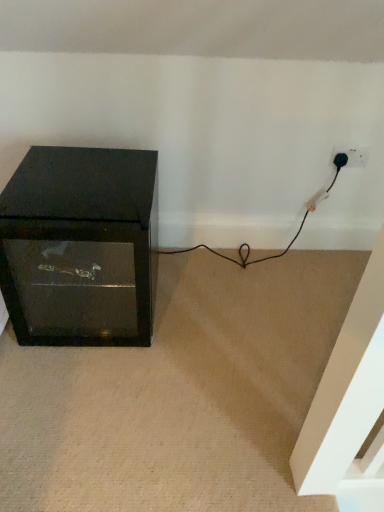
Question: Does point (104, 198) appear closer or farther from the camera than point (339, 163)?

Choices:
 (A) farther
 (B) closer

Answer: (B)

Question: From a real-world perspective, is matte black cabinet at left positioned above or below black plastic plug at lower right?

Choices:
 (A) below
 (B) above

Answer: (A)

Question: Is matte black cabinet at left to the left or to the right of black plastic plug at lower right in the image?

Choices:
 (A) right
 (B) left

Answer: (B)

Question: Looking at their shapes, would you say black plastic plug at lower right is wider or thinner than matte black cabinet at left?

Choices:
 (A) thin
 (B) wide

Answer: (A)

Question: Is black plastic plug at lower right in front of or behind matte black cabinet at left in the image?

Choices:
 (A) behind
 (B) front

Answer: (A)

Question: From the image's perspective, relative to matte black cabinet at left, is black plastic plug at lower right above or below?

Choices:
 (A) above
 (B) below

Answer: (A)

Question: Considering the positions of black plastic plug at lower right and matte black cabinet at left in the image, is black plastic plug at lower right bigger or smaller than matte black cabinet at left?

Choices:
 (A) small
 (B) big

Answer: (A)